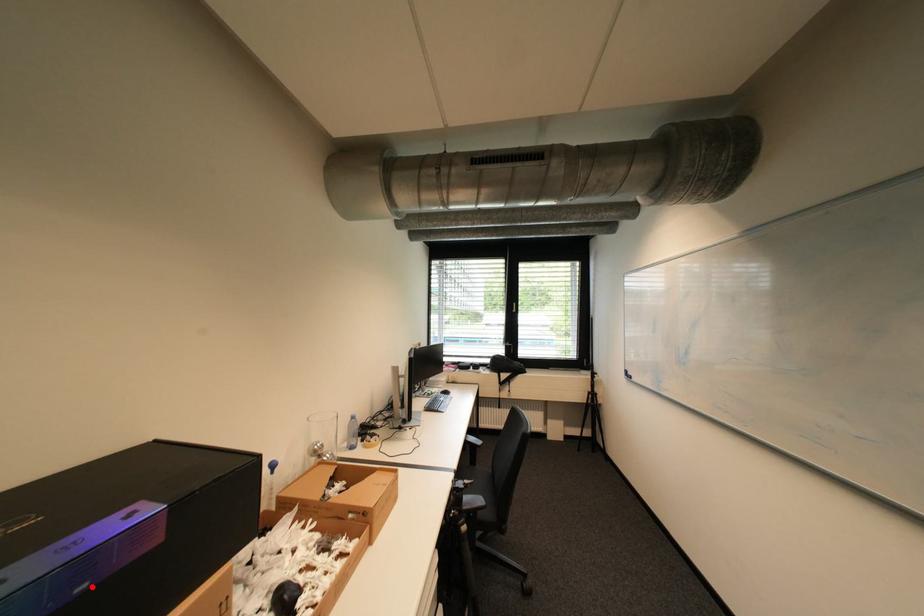
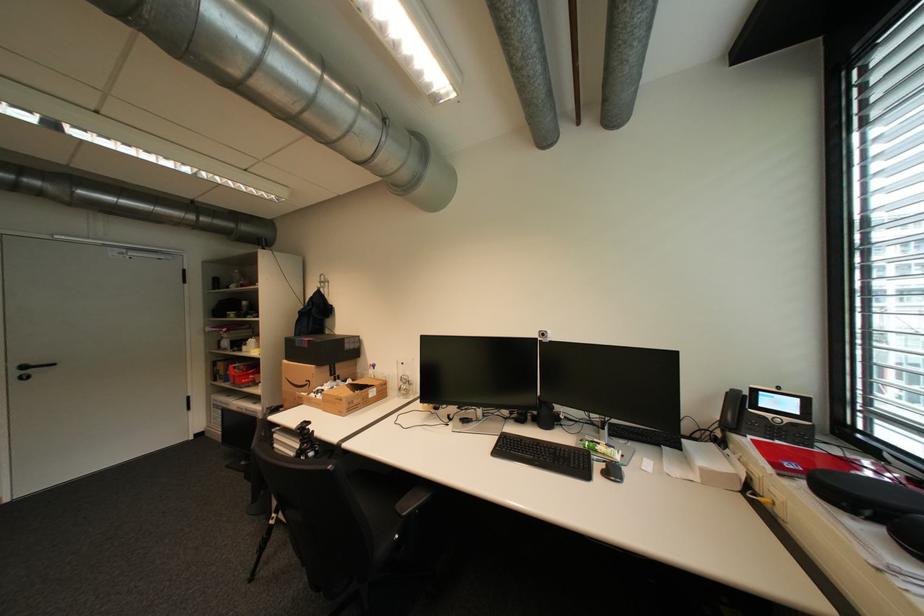
The point at the highlighted location is marked in the first image. Where is the corresponding point in the second image?

(310, 346)